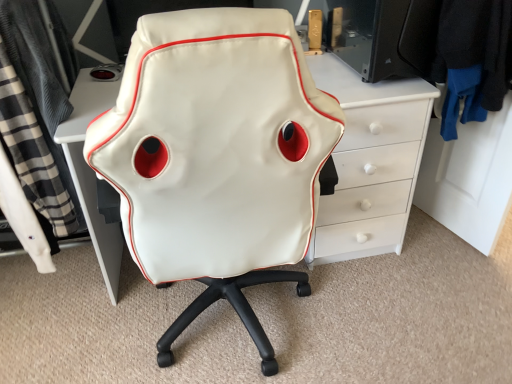
Measure the distance between white leather chair at center and camera.

The distance of white leather chair at center from camera is 26.12 inches.

Locate an element on the screen. black fabric jacket at upper right, which is the 1th clothing from right to left is located at coordinates (472, 59).

This screenshot has height=384, width=512. In order to click on white leather chair at center in this screenshot , I will do `click(217, 156)`.

Does point (15, 30) come farther from viewer compared to point (474, 78)?

No.

Between black plaid fabric at left, which appears as the 1th clothing when viewed from the left, and black fabric jacket at upper right, which is the 1th clothing from right to left, which one appears on the right side from the viewer's perspective?

black fabric jacket at upper right, which is the 1th clothing from right to left, is more to the right.

Is black plaid fabric at left, the 2th clothing viewed from the right, positioned before black fabric jacket at upper right, the 2th clothing when ordered from left to right?

Yes, it is in front of black fabric jacket at upper right, the 2th clothing when ordered from left to right.

Can you confirm if black fabric jacket at upper right, which is the 1th clothing from right to left, is smaller than white leather chair at center?

Indeed, black fabric jacket at upper right, which is the 1th clothing from right to left, has a smaller size compared to white leather chair at center.

Does black fabric jacket at upper right, which is the 1th clothing from right to left, turn towards white leather chair at center?

Yes, black fabric jacket at upper right, which is the 1th clothing from right to left, is facing white leather chair at center.

Which is more to the left, black fabric jacket at upper right, which is the 1th clothing from right to left, or white leather chair at center?

white leather chair at center.

Is white leather chair at center located within black fabric jacket at upper right, which is the 1th clothing from right to left?

No, white leather chair at center is not inside black fabric jacket at upper right, which is the 1th clothing from right to left.

Looking at this image, is white leather chair at center aimed at black fabric jacket at upper right, the 2th clothing when ordered from left to right?

No, white leather chair at center does not turn towards black fabric jacket at upper right, the 2th clothing when ordered from left to right.

From a real-world perspective, is white leather chair at center above or below black fabric jacket at upper right, which is the 1th clothing from right to left?

Clearly, from a real-world perspective, white leather chair at center is below black fabric jacket at upper right, which is the 1th clothing from right to left.

At what (x,y) coordinates should I click in order to perform the action: click on clothing that is the 2nd one when counting backward from the white leather chair at center. Please return your answer as a coordinate pair (x, y). Image resolution: width=512 pixels, height=384 pixels. Looking at the image, I should click on (472, 59).

Consider the image. Is white leather chair at center further to camera compared to black fabric jacket at upper right, which is the 1th clothing from right to left?

No, it is not.

From a real-world perspective, does black plaid fabric at left, which appears as the 1th clothing when viewed from the left, stand above white leather chair at center?

Yes, from a real-world perspective, black plaid fabric at left, which appears as the 1th clothing when viewed from the left, is over white leather chair at center

Between black plaid fabric at left, the 2th clothing viewed from the right, and white leather chair at center, which one has larger size?

With larger size is white leather chair at center.

What's the angular difference between black plaid fabric at left, the 2th clothing viewed from the right, and white leather chair at center's facing directions?

There is a 179-degree angle between the facing directions of black plaid fabric at left, the 2th clothing viewed from the right, and white leather chair at center.

Based on the photo, does black plaid fabric at left, which appears as the 1th clothing when viewed from the left, lie in front of white leather chair at center?

No, black plaid fabric at left, which appears as the 1th clothing when viewed from the left, is behind white leather chair at center.

Consider the image. Is white leather chair at center oriented away from black plaid fabric at left, which appears as the 1th clothing when viewed from the left?

No, white leather chair at center is not facing away from black plaid fabric at left, which appears as the 1th clothing when viewed from the left.

Is white leather chair at center bigger than black plaid fabric at left, the 2th clothing viewed from the right?

Yes.

Is there a large distance between white leather chair at center and black plaid fabric at left, the 2th clothing viewed from the right?

That's not correct — white leather chair at center is a little close to black plaid fabric at left, the 2th clothing viewed from the right.

Can black plaid fabric at left, the 2th clothing viewed from the right, be found inside white leather chair at center?

No.

Considering the positions of objects black fabric jacket at upper right, the 2th clothing when ordered from left to right, and black plaid fabric at left, the 2th clothing viewed from the right, in the image provided, who is more to the right, black fabric jacket at upper right, the 2th clothing when ordered from left to right, or black plaid fabric at left, the 2th clothing viewed from the right,?

black fabric jacket at upper right, the 2th clothing when ordered from left to right.

Identify the location of clothing in front of the black fabric jacket at upper right, the 2th clothing when ordered from left to right. The image size is (512, 384). (33, 112).

From the picture: Is black fabric jacket at upper right, the 2th clothing when ordered from left to right, facing towards black plaid fabric at left, which appears as the 1th clothing when viewed from the left?

Yes.

Is black fabric jacket at upper right, the 2th clothing when ordered from left to right, thinner than black plaid fabric at left, the 2th clothing viewed from the right?

Yes, black fabric jacket at upper right, the 2th clothing when ordered from left to right, is thinner than black plaid fabric at left, the 2th clothing viewed from the right.

At what (x,y) coordinates should I click in order to perform the action: click on clothing on the left of the black fabric jacket at upper right, which is the 1th clothing from right to left. Please return your answer as a coordinate pair (x, y). Looking at the image, I should click on (33, 112).

There is a white leather chair at center. Where is `the 2nd clothing above it (from a real-world perspective)`? This screenshot has height=384, width=512. the 2nd clothing above it (from a real-world perspective) is located at coordinates (472, 59).

Estimate the real-world distances between objects in this image. Which object is closer to white leather chair at center, black fabric jacket at upper right, the 2th clothing when ordered from left to right, or black plaid fabric at left, which appears as the 1th clothing when viewed from the left?

Among the two, black plaid fabric at left, which appears as the 1th clothing when viewed from the left, is located nearer to white leather chair at center.

Looking at the image, which one is located further to black fabric jacket at upper right, which is the 1th clothing from right to left, black plaid fabric at left, the 2th clothing viewed from the right, or white leather chair at center?

The object further to black fabric jacket at upper right, which is the 1th clothing from right to left, is black plaid fabric at left, the 2th clothing viewed from the right.

From the picture: Which object lies further to the anchor point black plaid fabric at left, which appears as the 1th clothing when viewed from the left, black fabric jacket at upper right, the 2th clothing when ordered from left to right, or white leather chair at center?

black fabric jacket at upper right, the 2th clothing when ordered from left to right, is further to black plaid fabric at left, which appears as the 1th clothing when viewed from the left.

Estimate the real-world distances between objects in this image. Which object is closer to black fabric jacket at upper right, the 2th clothing when ordered from left to right, white leather chair at center or black plaid fabric at left, the 2th clothing viewed from the right?

white leather chair at center is closer to black fabric jacket at upper right, the 2th clothing when ordered from left to right.

Which object lies nearer to the anchor point black plaid fabric at left, which appears as the 1th clothing when viewed from the left, white leather chair at center or black fabric jacket at upper right, the 2th clothing when ordered from left to right?

Among the two, white leather chair at center is located nearer to black plaid fabric at left, which appears as the 1th clothing when viewed from the left.

Estimate the real-world distances between objects in this image. Which object is further from white leather chair at center, black plaid fabric at left, which appears as the 1th clothing when viewed from the left, or black fabric jacket at upper right, the 2th clothing when ordered from left to right?

black fabric jacket at upper right, the 2th clothing when ordered from left to right.

Find the location of a particular element. chair situated between black plaid fabric at left, the 2th clothing viewed from the right, and black fabric jacket at upper right, the 2th clothing when ordered from left to right, from left to right is located at coordinates (217, 156).